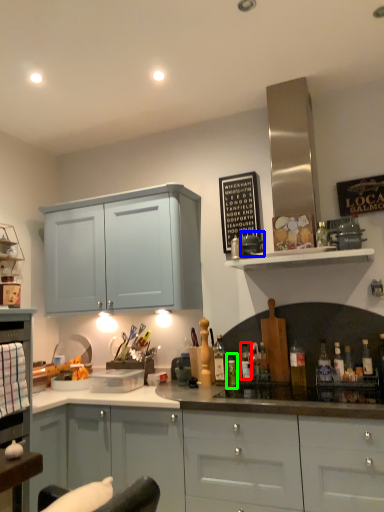
Question: Based on their relative distances, which object is farther from bottle (highlighted by a red box)? Choose from appliance (highlighted by a blue box) and bottle (highlighted by a green box).

Choices:
 (A) appliance
 (B) bottle

Answer: (A)